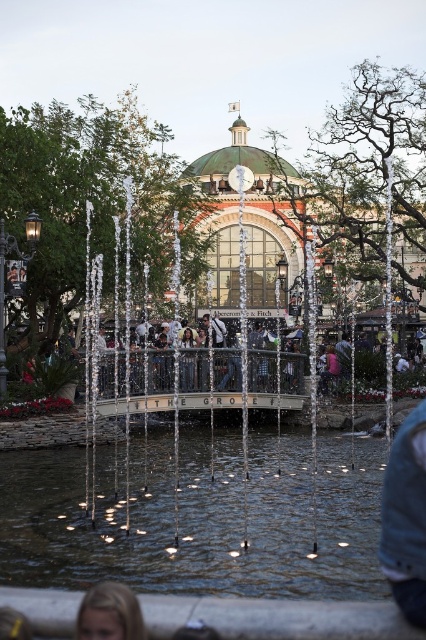
Question: Does clear water at center have a larger size compared to blonde hair at lower left?

Choices:
 (A) no
 (B) yes

Answer: (B)

Question: In this image, where is clear water at center located relative to blonde hair at lower left?

Choices:
 (A) right
 (B) left

Answer: (A)

Question: Estimate the real-world distances between objects in this image. Which object is farther from the denim jacket at lower right?

Choices:
 (A) clear water at center
 (B) blonde hair at lower left

Answer: (B)

Question: Which is nearer to the denim jacket at lower right?

Choices:
 (A) clear water at center
 (B) blonde hair at lower left

Answer: (A)

Question: Does clear water at center have a greater width compared to denim jacket at lower right?

Choices:
 (A) yes
 (B) no

Answer: (A)

Question: Which object is closer to the camera taking this photo?

Choices:
 (A) clear water at center
 (B) blonde hair at lower left

Answer: (B)